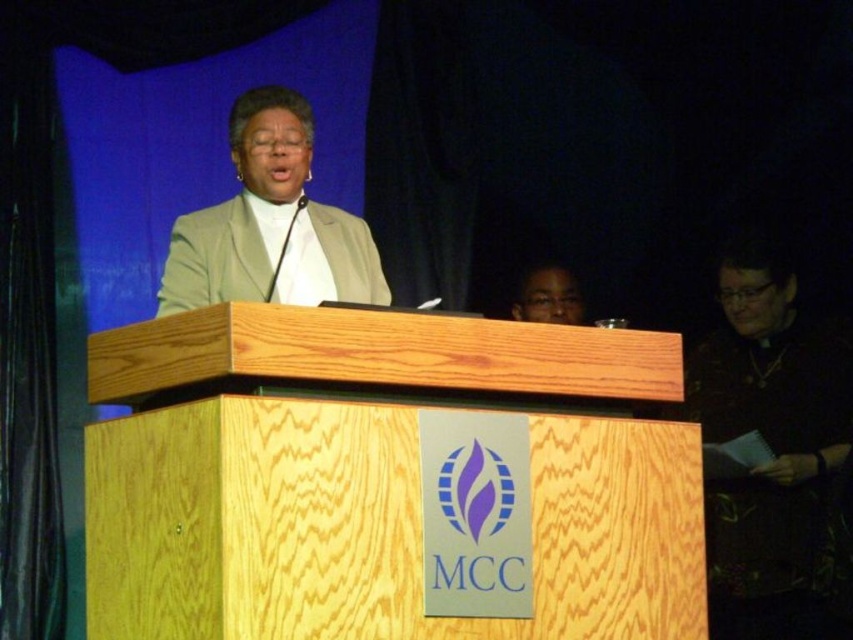
Is beige fabric jacket at center taller than matte black glasses at upper center?

Indeed, beige fabric jacket at center has a greater height compared to matte black glasses at upper center.

What do you see at coordinates (270, 224) in the screenshot? I see `beige fabric jacket at center` at bounding box center [270, 224].

Is point (283, 205) less distant than point (579, 294)?

Yes, point (283, 205) is in front of point (579, 294).

Locate an element on the screen. This screenshot has height=640, width=853. beige fabric jacket at center is located at coordinates (270, 224).

Describe the element at coordinates (770, 448) in the screenshot. I see `black leather jacket at upper right` at that location.

Who is taller, black leather jacket at upper right or beige fabric jacket at center?

With more height is black leather jacket at upper right.

Who is more distant from viewer, (779, 472) or (218, 248)?

The point (779, 472) is behind.

The width and height of the screenshot is (853, 640). I want to click on black leather jacket at upper right, so click(770, 448).

Can you confirm if black leather jacket at upper right is thinner than matte black glasses at upper center?

No, black leather jacket at upper right is not thinner than matte black glasses at upper center.

Is point (795, 362) farther from viewer compared to point (560, 301)?

No.

The width and height of the screenshot is (853, 640). What do you see at coordinates (770, 448) in the screenshot?
I see `black leather jacket at upper right` at bounding box center [770, 448].

The width and height of the screenshot is (853, 640). I want to click on black leather jacket at upper right, so click(770, 448).